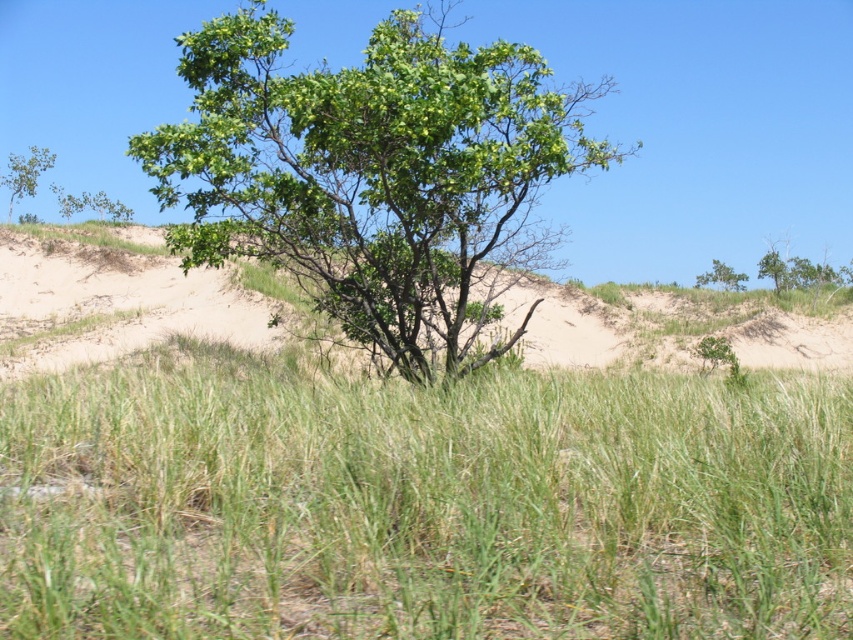
Question: From the image, what is the correct spatial relationship of green grassy at center in relation to green leafy tree at upper right?

Choices:
 (A) left
 (B) right

Answer: (A)

Question: Which object is farther from the camera taking this photo?

Choices:
 (A) green leafy tree at upper right
 (B) green leafy tree at center
 (C) green grassy at center
 (D) green leafy tree at upper left

Answer: (A)

Question: Based on their relative distances, which object is farther from the green leafy tree at upper left?

Choices:
 (A) green leafy tree at upper right
 (B) green grassy at center

Answer: (B)

Question: Which is nearer to the green leafy tree at upper left?

Choices:
 (A) green grassy at center
 (B) green leafy tree at center
 (C) green leafy tree at upper right

Answer: (B)

Question: Considering the relative positions of green leafy tree at center and green leafy tree at upper left in the image provided, where is green leafy tree at center located with respect to green leafy tree at upper left?

Choices:
 (A) below
 (B) above

Answer: (A)

Question: In this image, where is green leafy tree at center located relative to green leafy tree at upper right?

Choices:
 (A) above
 (B) below

Answer: (A)